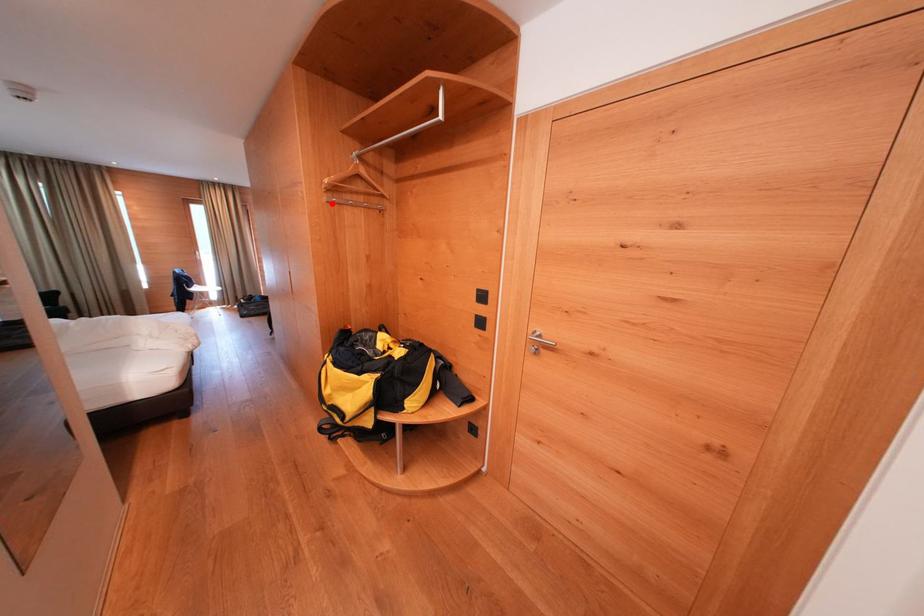
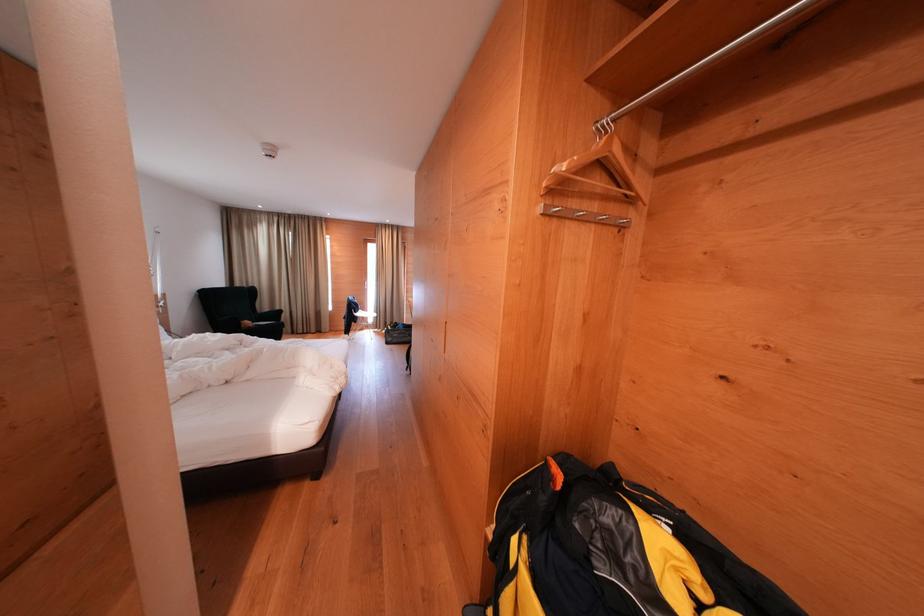
The point at the highlighted location is marked in the first image. Where is the corresponding point in the second image?

(546, 213)